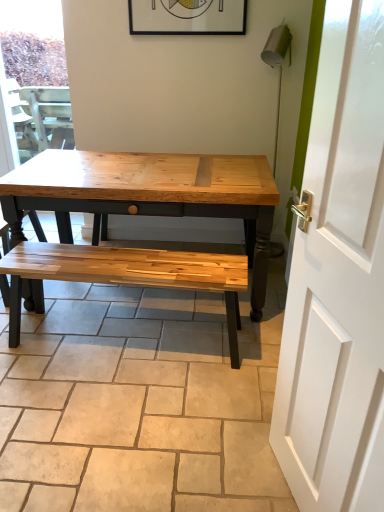
Find the location of a particular element. The width and height of the screenshot is (384, 512). matte black picture frame at upper center is located at coordinates (187, 17).

Describe the element at coordinates (187, 17) in the screenshot. The image size is (384, 512). I see `matte black picture frame at upper center` at that location.

The height and width of the screenshot is (512, 384). Identify the location of matte black picture frame at upper center. (187, 17).